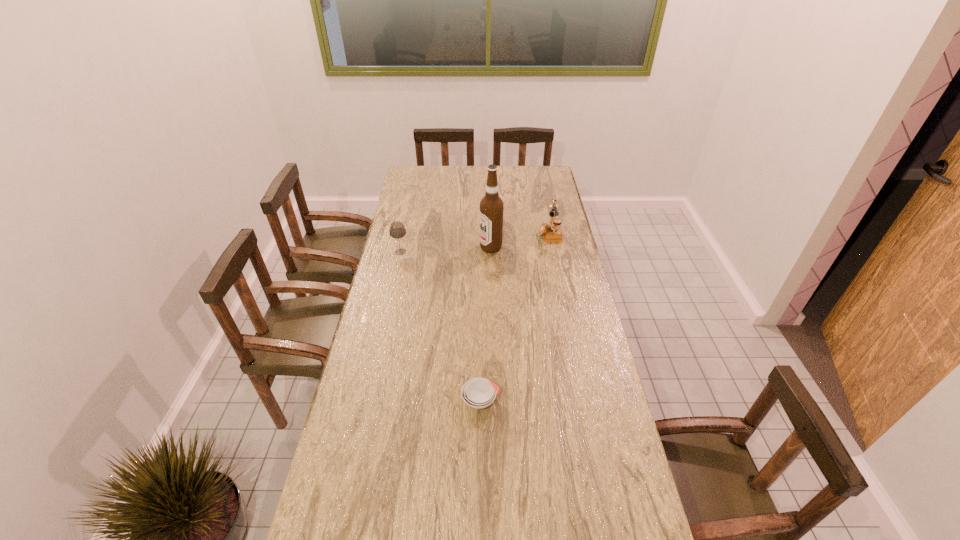
Where is `free spot that satisfies the following two spatial constraints: 1. on the label of the alcohol; 2. on the front side of the nearest object`? The height and width of the screenshot is (540, 960). free spot that satisfies the following two spatial constraints: 1. on the label of the alcohol; 2. on the front side of the nearest object is located at coordinates (495, 401).

Identify the location of free spot that satisfies the following two spatial constraints: 1. on the dial number of the rightmost object; 2. on the front side of the shortest object. (583, 401).

Where is `free region that satisfies the following two spatial constraints: 1. on the dial number of the rightmost object; 2. on the front side of the leftmost object`? The height and width of the screenshot is (540, 960). free region that satisfies the following two spatial constraints: 1. on the dial number of the rightmost object; 2. on the front side of the leftmost object is located at coordinates (553, 252).